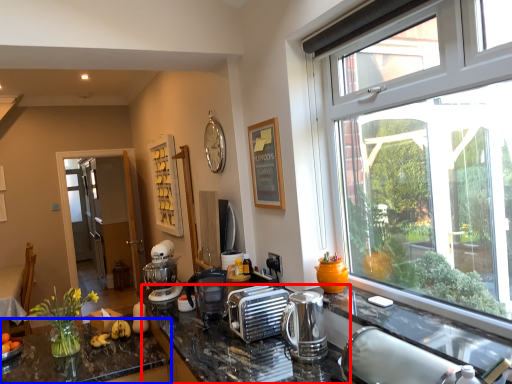
Question: Which object is closer to the camera taking this photo, counter top (highlighted by a red box) or countertop (highlighted by a blue box)?

Choices:
 (A) counter top
 (B) countertop

Answer: (A)